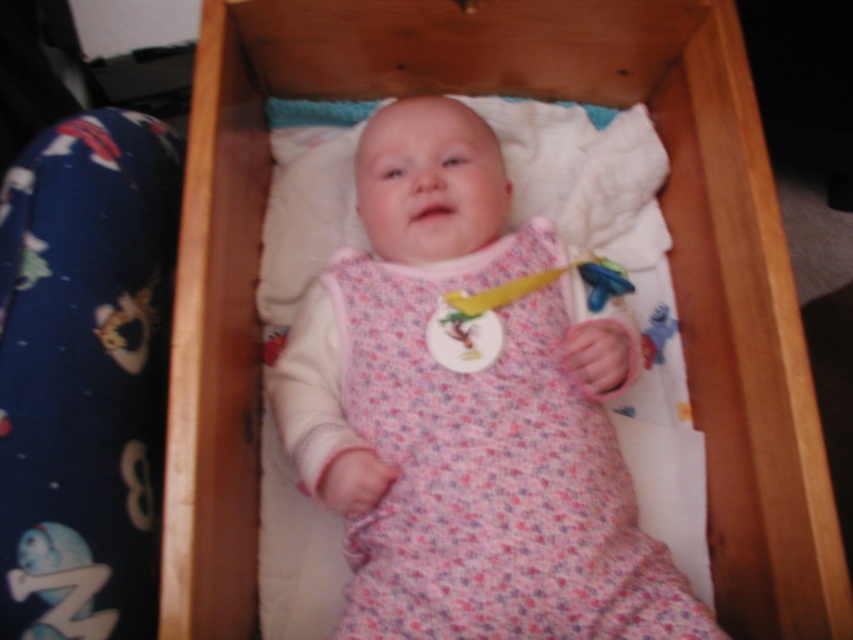
Question: Which point is farther to the camera?

Choices:
 (A) blue rubber toy at lower left
 (B) pink floral fabric baby at center

Answer: (B)

Question: Which of the following is the closest to the observer?

Choices:
 (A) blue rubber toy at lower left
 (B) pink fabric rattle at center
 (C) pink floral fabric baby at center

Answer: (A)

Question: Is pink floral fabric baby at center further to the viewer compared to blue rubber toy at lower left?

Choices:
 (A) yes
 (B) no

Answer: (A)

Question: Can you confirm if pink floral fabric baby at center is positioned below blue rubber toy at lower left?

Choices:
 (A) yes
 (B) no

Answer: (B)

Question: Can you confirm if pink floral fabric baby at center is positioned below blue rubber toy at lower left?

Choices:
 (A) no
 (B) yes

Answer: (A)

Question: Which object appears farthest from the camera in this image?

Choices:
 (A) pink floral fabric baby at center
 (B) blue rubber toy at lower left
 (C) pink fabric rattle at center

Answer: (C)